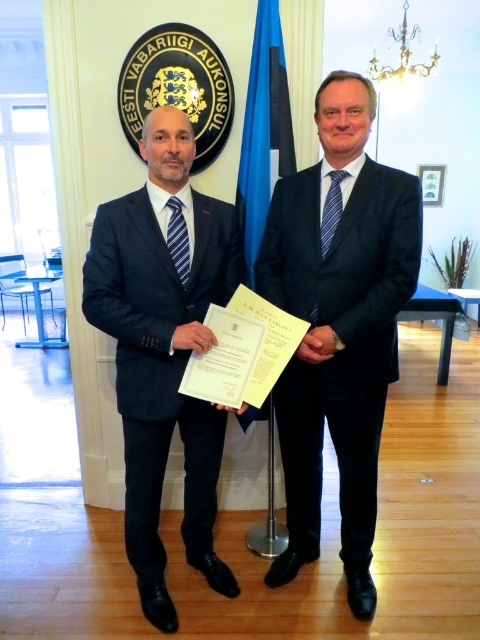
You are an event planner arranging a photo shoot at the Estonian Consulate. You need to position two models wearing the dark blue suit at center and the matte black suit at center. According to the scene, which suit is positioned higher in the frame?

Result: The dark blue suit at center is above the matte black suit at center, so the dark blue suit is positioned higher in the frame.

You are a photographer preparing to take a group photo of two men wearing suits. You notice the dark blue suit at center and the matte black suit at center. Which suit should you adjust the lighting to highlight more, considering their visibility against the background?

The dark blue suit at center might be wider than matte black suit at center, so adjusting the lighting to highlight the dark blue suit at center could make it stand out more against the background.